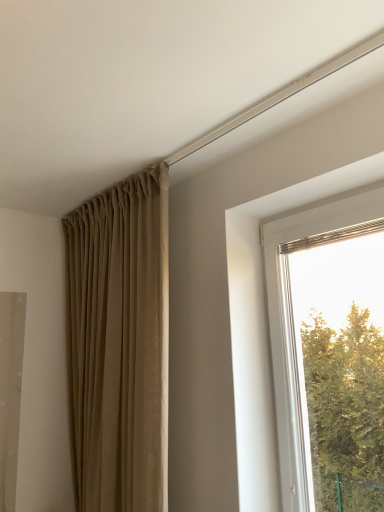
Locate an element on the screen. This screenshot has height=512, width=384. beige fabric curtain at upper center is located at coordinates (118, 344).

Describe the element at coordinates (118, 344) in the screenshot. Image resolution: width=384 pixels, height=512 pixels. I see `beige fabric curtain at upper center` at that location.

Locate an element on the screen. This screenshot has height=512, width=384. beige fabric curtain at upper center is located at coordinates (118, 344).